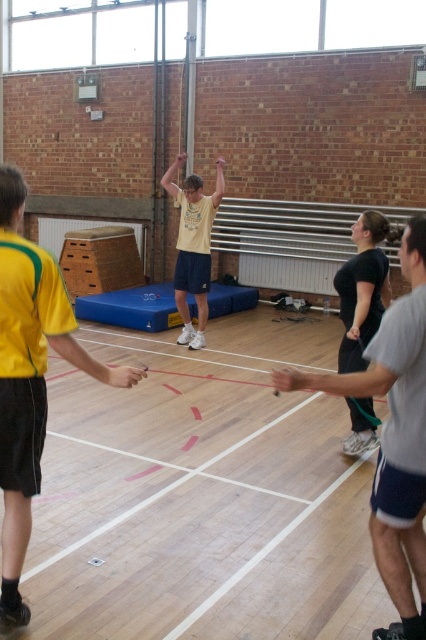
Is point (3, 317) positioned after point (411, 620)?

Yes.

Does yellow jersey at left have a lesser height compared to gray fabric shorts at center?

In fact, yellow jersey at left may be taller than gray fabric shorts at center.

Who is more distant from viewer, (20, 339) or (373, 387)?

The point (20, 339) is behind.

Identify the location of yellow jersey at left. (29, 380).

Who is lower down, gray fabric shorts at center or yellow matte shirt at center?

gray fabric shorts at center

Describe the element at coordinates (394, 436) in the screenshot. The image size is (426, 640). I see `gray fabric shorts at center` at that location.

Where is `gray fabric shorts at center`? This screenshot has height=640, width=426. gray fabric shorts at center is located at coordinates (394, 436).

Which is behind, point (43, 259) or point (207, 211)?

Positioned behind is point (207, 211).

Who is shorter, yellow jersey at left or yellow matte shirt at center?

yellow jersey at left

Which is behind, point (8, 380) or point (187, 232)?

The point (187, 232) is more distant.

You are a GUI agent. You are given a task and a screenshot of the screen. Output one action in this format:
    pyautogui.click(x=<x>, y=<y>)
    Task: Click on the yellow jersey at left
    
    Given the screenshot: What is the action you would take?
    pyautogui.click(x=29, y=380)